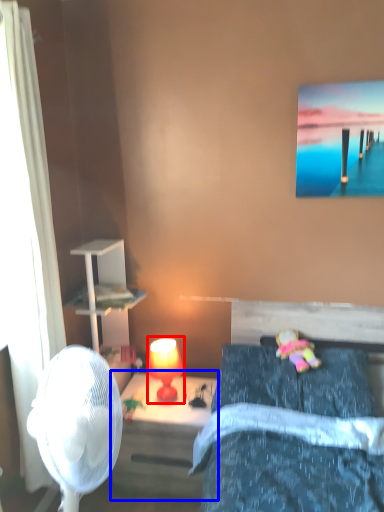
Question: Which object appears farthest to the camera in this image, table lamp (highlighted by a red box) or nightstand (highlighted by a blue box)?

Choices:
 (A) table lamp
 (B) nightstand

Answer: (A)